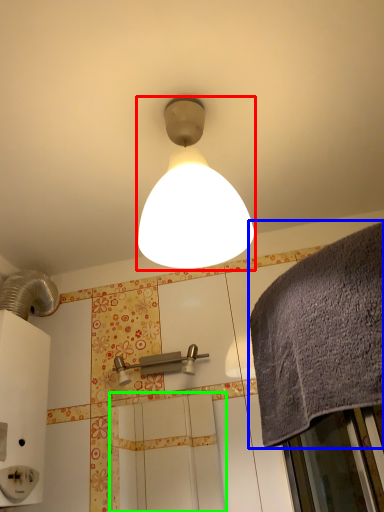
Question: Based on their relative distances, which object is farther from lamp (highlighted by a red box)? Choose from bath towel (highlighted by a blue box) and screen door (highlighted by a green box).

Choices:
 (A) bath towel
 (B) screen door

Answer: (B)